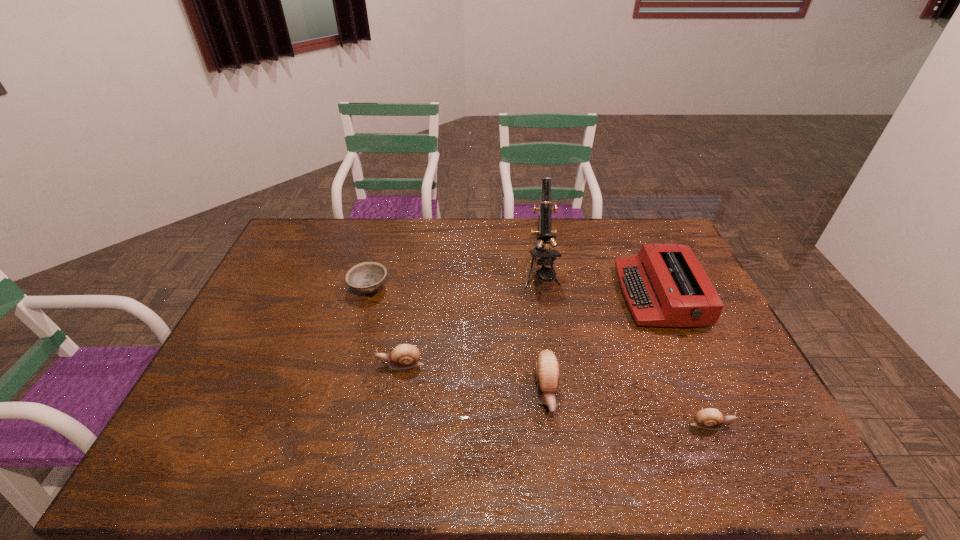
Identify the location of the fifth object from right to left. The height and width of the screenshot is (540, 960). (403, 356).

Find the location of a particular element. The image size is (960, 540). the second tallest escargot is located at coordinates (403, 356).

The height and width of the screenshot is (540, 960). I want to click on the tallest escargot, so click(547, 369).

The height and width of the screenshot is (540, 960). What are the coordinates of `the shortest escargot` in the screenshot? It's located at (709, 418).

Find the location of a particular element. The image size is (960, 540). typewriter is located at coordinates (665, 285).

In order to click on bowl in this screenshot , I will do `click(367, 277)`.

Where is `the tallest object`? This screenshot has width=960, height=540. the tallest object is located at coordinates (544, 233).

Identify the location of vacant area situated on the front-facing side of the leftmost escargot. (320, 364).

What are the coordinates of `vacant space situated on the front-facing side of the leftmost escargot` in the screenshot? It's located at (338, 364).

Locate an element on the screen. The image size is (960, 540). vacant area situated on the front-facing side of the leftmost escargot is located at coordinates (338, 364).